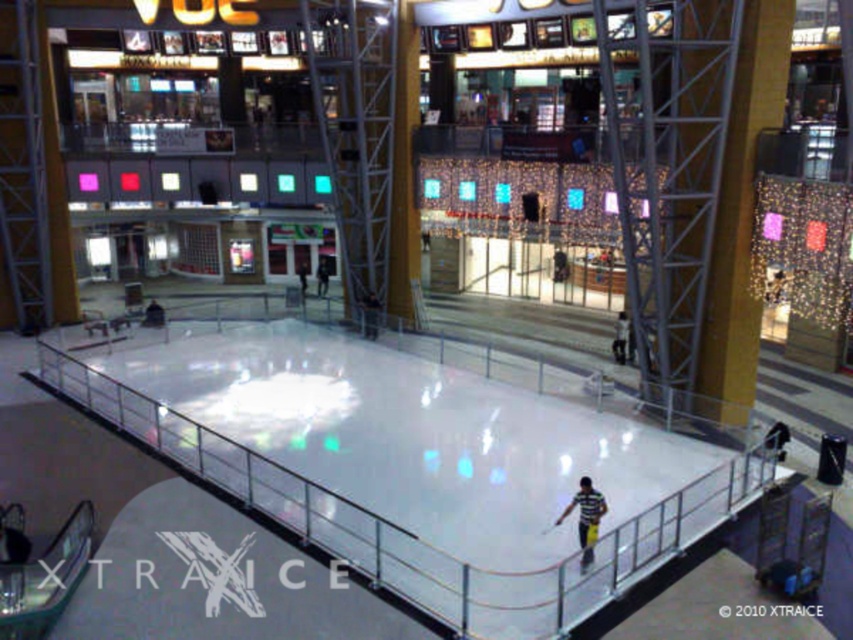
Locate an element on the screen. This screenshot has width=853, height=640. white smooth ice skating rink at center is located at coordinates (418, 464).

Does point (733, 499) come farther from viewer compared to point (592, 531)?

Yes, it is.

I want to click on white smooth ice skating rink at center, so 418,464.